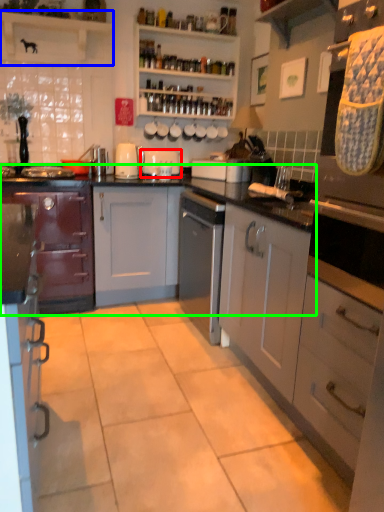
Question: Estimate the real-world distances between objects in this image. Which object is closer to appliance (highlighted by a red box), shelf (highlighted by a blue box) or cabinetry (highlighted by a green box)?

Choices:
 (A) shelf
 (B) cabinetry

Answer: (B)